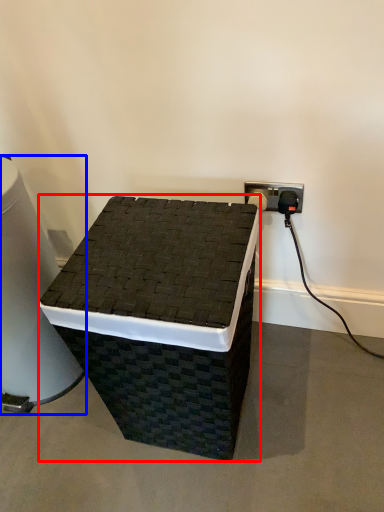
Question: Which object appears closest to the camera in this image, furniture (highlighted by a red box) or water cooler (highlighted by a blue box)?

Choices:
 (A) furniture
 (B) water cooler

Answer: (A)